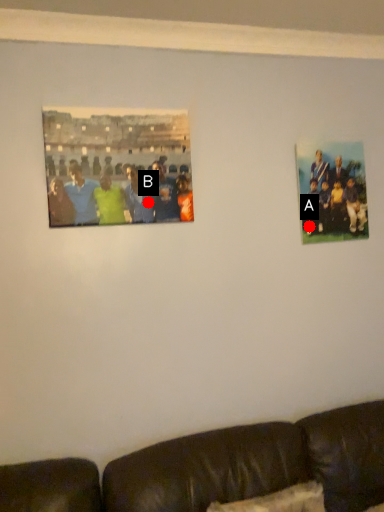
Question: Two points are circled on the image, labeled by A and B beside each circle. Which point is further to the camera?

Choices:
 (A) A is further
 (B) B is further

Answer: (A)